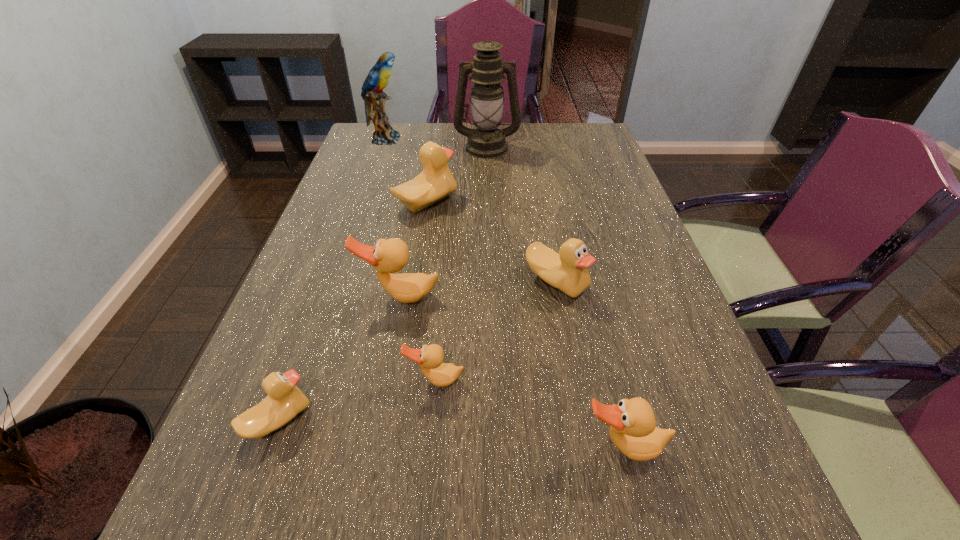
Locate an element on the screen. the leftmost duck is located at coordinates (285, 400).

Locate an element on the screen. This screenshot has width=960, height=540. the third nearest duck is located at coordinates (430, 358).

The height and width of the screenshot is (540, 960). Find the location of `the second farthest tan duck`. the second farthest tan duck is located at coordinates [x=430, y=358].

Locate an element on the screen. vacant area situated on the left of the oil lamp is located at coordinates (365, 147).

Image resolution: width=960 pixels, height=540 pixels. What are the coordinates of `free space located on the face of the parrot` in the screenshot? It's located at (479, 139).

The width and height of the screenshot is (960, 540). Find the location of `vacant point located 0.050m at the beak of the biggest beige duck`. vacant point located 0.050m at the beak of the biggest beige duck is located at coordinates (474, 202).

In order to click on vacant space located on the beak of the farthest tan duck in this screenshot , I will do `click(384, 380)`.

The image size is (960, 540). Identify the location of vacant space situated 0.050m at the beak of the rightmost beige duck. (564, 321).

At what (x,y) coordinates should I click in order to perform the action: click on free spot located on the beak of the rightmost tan duck. Please return your answer as a coordinate pair (x, y). Looking at the image, I should click on (639, 513).

This screenshot has width=960, height=540. In order to click on vacant region located at the beak of the nearest beige duck in this screenshot , I will do `click(486, 420)`.